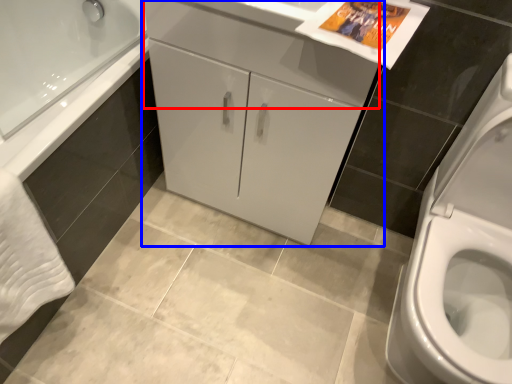
Question: Which object appears closest to the camera in this image, drawer (highlighted by a red box) or bathroom cabinet (highlighted by a blue box)?

Choices:
 (A) drawer
 (B) bathroom cabinet

Answer: (A)